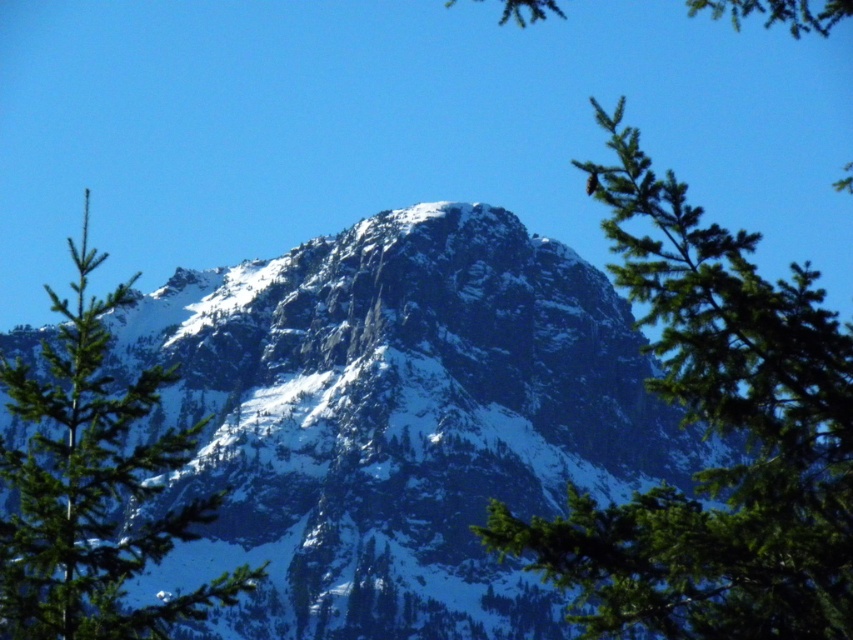
The height and width of the screenshot is (640, 853). Describe the element at coordinates (398, 422) in the screenshot. I see `white rocky mountain at center` at that location.

Is white rocky mountain at center thinner than green matte tree at center?

No, white rocky mountain at center is not thinner than green matte tree at center.

Between point (305, 348) and point (177, 525), which one is positioned behind?

The point (305, 348) is behind.

In order to click on white rocky mountain at center in this screenshot , I will do `click(398, 422)`.

Between point (758, 438) and point (129, 416), which one is positioned in front?

Positioned in front is point (129, 416).

How distant is green needle-like branches at center from green matte tree at center?

A distance of 63.54 feet exists between green needle-like branches at center and green matte tree at center.

Does point (637, 164) lie behind point (167, 518)?

No, it is in front of (167, 518).

The image size is (853, 640). I want to click on green needle-like branches at center, so click(717, 432).

Is white rocky mountain at center thinner than green needle-like branches at center?

No.

Is white rocky mountain at center to the left of green needle-like branches at center from the viewer's perspective?

Yes, white rocky mountain at center is to the left of green needle-like branches at center.

Does point (402, 376) come in front of point (650, 388)?

No.

Identify the location of white rocky mountain at center. (398, 422).